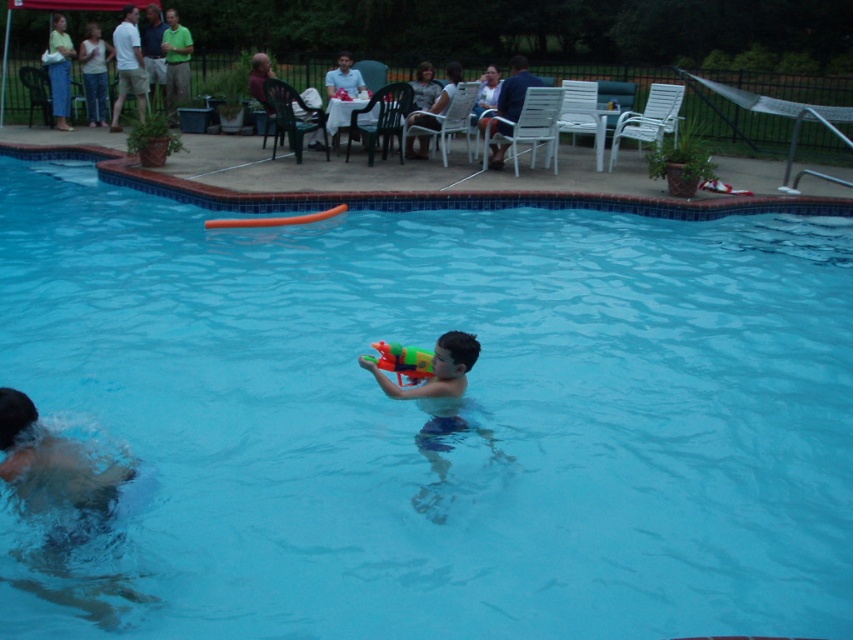
You are standing at point (424, 144) and want to walk to the pool. Is the point (67, 116) behind you or in front of you?

Point (67, 116) is behind point (424, 144), so it is behind you.

You are organizing a pool party and need to arrange seating based on the size of the guests. You notice the light green cotton shirt at upper left and the gray fabric shirt at upper center. Which guest should you provide a larger chair for?

The light green cotton shirt at upper left has a larger size compared to gray fabric shirt at upper center, so you should provide a larger chair for the guest wearing the light green cotton shirt at upper left.